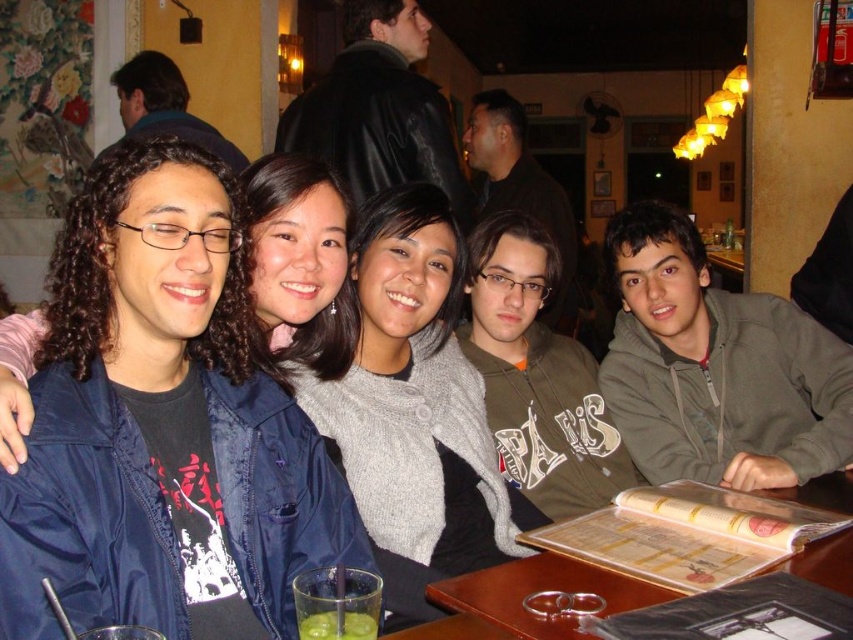
Question: Can you confirm if gray fleece hoodie at right is bigger than wooden table at lower center?

Choices:
 (A) no
 (B) yes

Answer: (B)

Question: Can you confirm if matte gray sweater at center is positioned to the left of green translucent glass at lower center?

Choices:
 (A) no
 (B) yes

Answer: (B)

Question: Observing the image, what is the correct spatial positioning of gray fleece hoodie at right in reference to wooden table at lower center?

Choices:
 (A) above
 (B) below

Answer: (A)

Question: Among these points, which one is nearest to the camera?

Choices:
 (A) (824, 410)
 (B) (370, 243)

Answer: (B)

Question: Which point is closer to the camera?

Choices:
 (A) gray wool sweater at center
 (B) matte gray sweater at center

Answer: (B)

Question: Which point appears closest to the camera in this image?

Choices:
 (A) (189, 259)
 (B) (357, 637)
 (C) (373, 612)

Answer: (B)